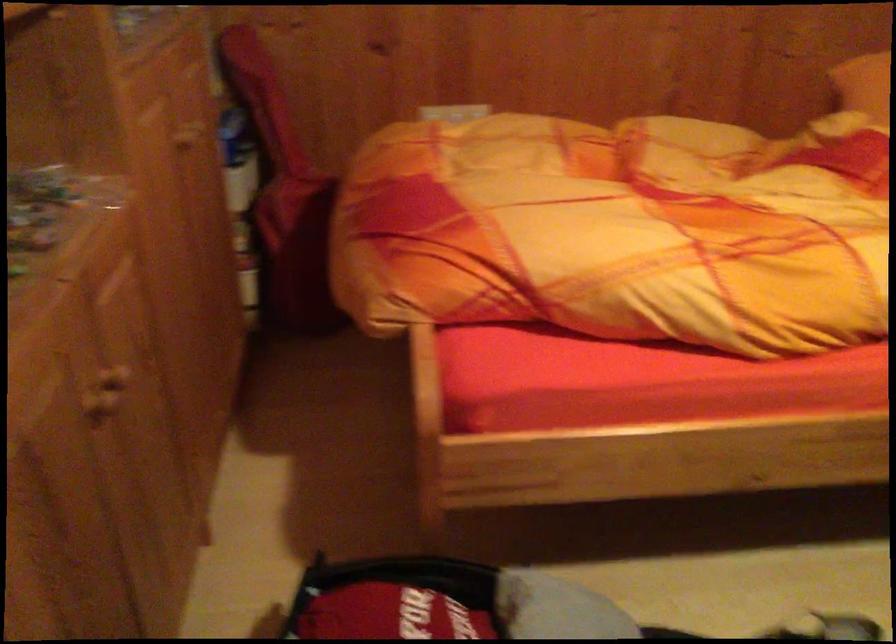
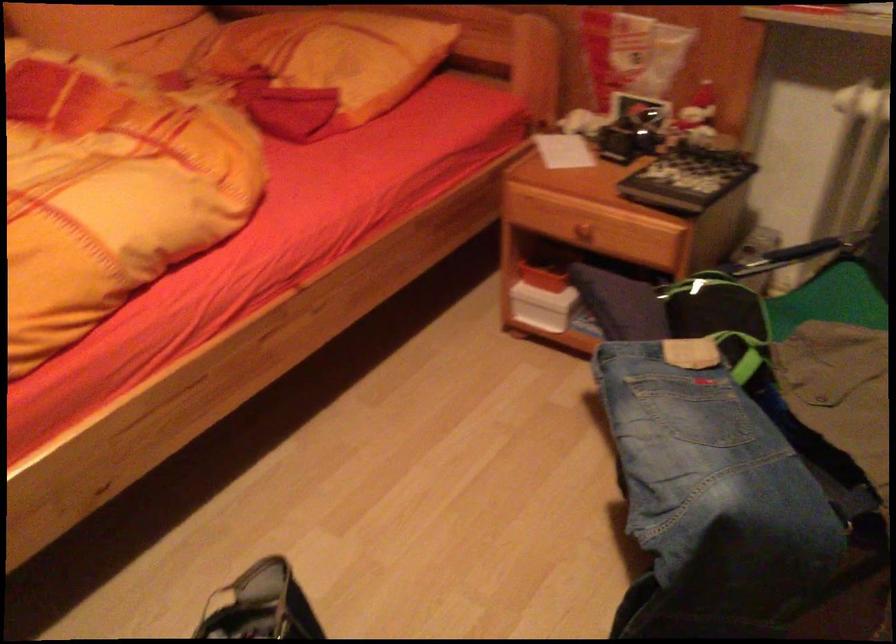
Question: The camera is either moving clockwise (left) or counter-clockwise (right) around the object. The first image is from the beginning of the video and the second image is from the end. Is the camera moving left or right when shooting the video?

Choices:
 (A) Left
 (B) Right

Answer: (A)